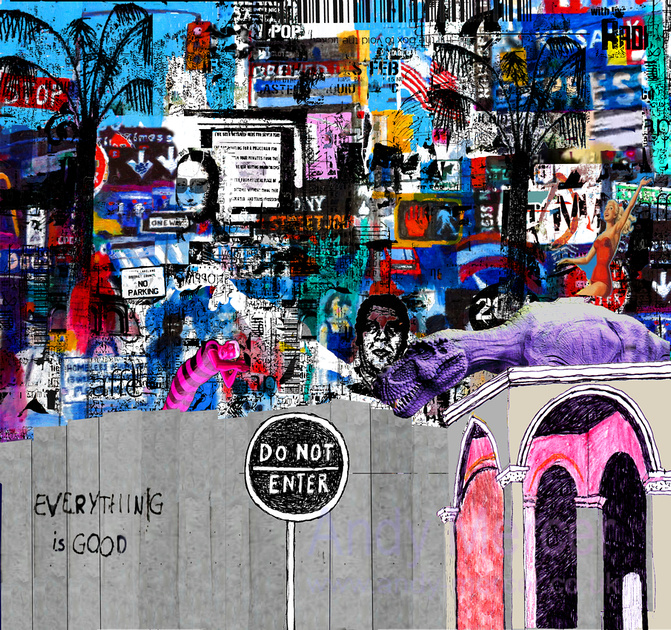
I want to click on column, so click(510, 420).